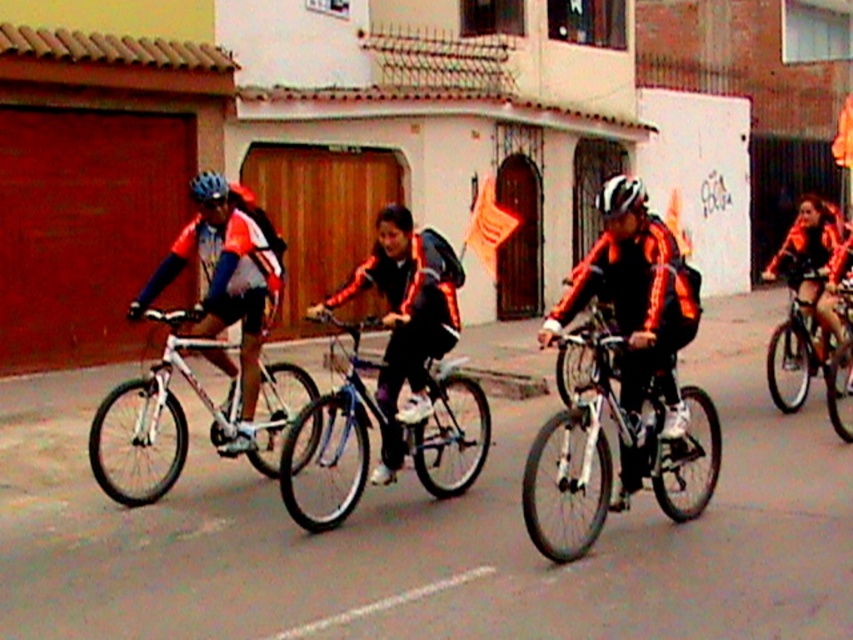
You are a GUI agent. You are given a task and a screenshot of the screen. Output one action in this format:
    pyautogui.click(x=<x>, y=<y>)
    Task: Click on the matte blue helmet at left
    This screenshot has height=640, width=853.
    Given the screenshot: What is the action you would take?
    pyautogui.click(x=228, y=285)

Is matte blue helmet at left to the left of white metallic bicycle at left from the viewer's perspective?

No, matte blue helmet at left is not to the left of white metallic bicycle at left.

Between point (247, 282) and point (171, 417), which one is positioned behind?

Point (171, 417)

Identify the location of matte blue helmet at left. The height and width of the screenshot is (640, 853). tap(228, 285).

Is matte black jacket at center thinner than shiny metallic bicycle at right?

No.

What do you see at coordinates (405, 317) in the screenshot? I see `matte black jacket at center` at bounding box center [405, 317].

Find the location of a particular element. Image resolution: width=853 pixels, height=640 pixels. matte black jacket at center is located at coordinates (405, 317).

Between point (430, 390) and point (596, 204), which one is positioned behind?

The point (596, 204) is more distant.

Which is more to the right, blue metallic bicycle at center or white matte bicycle helmet at center?

white matte bicycle helmet at center

This screenshot has height=640, width=853. What do you see at coordinates (379, 429) in the screenshot?
I see `blue metallic bicycle at center` at bounding box center [379, 429].

What are the coordinates of `blue metallic bicycle at center` in the screenshot? It's located at (379, 429).